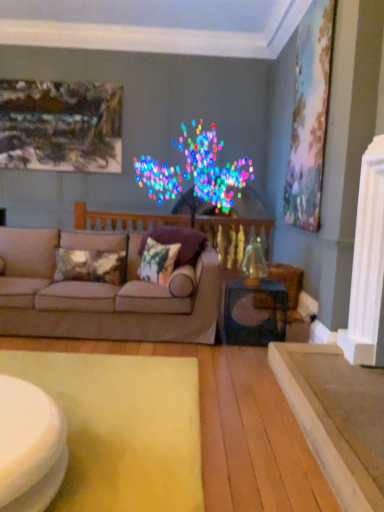
Question: Is metallic sheen pillow at center, which is the third pillow from right to left, taller than pastel canvas painting at upper right, the 2th picture frame when ordered from left to right?

Choices:
 (A) yes
 (B) no

Answer: (B)

Question: Can we say metallic sheen pillow at center, which is the third pillow from right to left, lies outside pastel canvas painting at upper right, positioned as the first picture frame in front-to-back order?

Choices:
 (A) yes
 (B) no

Answer: (A)

Question: Considering the relative sizes of metallic sheen pillow at center, marked as the first pillow in a left-to-right arrangement, and pastel canvas painting at upper right, positioned as the first picture frame in front-to-back order, in the image provided, is metallic sheen pillow at center, marked as the first pillow in a left-to-right arrangement, shorter than pastel canvas painting at upper right, positioned as the first picture frame in front-to-back order,?

Choices:
 (A) yes
 (B) no

Answer: (A)

Question: Can you confirm if metallic sheen pillow at center, which is the third pillow from right to left, is positioned to the right of pastel canvas painting at upper right, the 2th picture frame when ordered from left to right?

Choices:
 (A) yes
 (B) no

Answer: (B)

Question: From a real-world perspective, is metallic sheen pillow at center, marked as the first pillow in a left-to-right arrangement, positioned under pastel canvas painting at upper right, positioned as the first picture frame in front-to-back order, based on gravity?

Choices:
 (A) yes
 (B) no

Answer: (A)

Question: From the image's perspective, would you say metallic sheen pillow at center, which is the third pillow from right to left, is positioned over pastel canvas painting at upper right, the 1th picture frame positioned from the right?

Choices:
 (A) no
 (B) yes

Answer: (A)

Question: From the image's perspective, is beige fabric couch at center on velvet floral pillow at center, the first pillow in the right-to-left sequence?

Choices:
 (A) no
 (B) yes

Answer: (A)

Question: Can we say beige fabric couch at center lies outside velvet floral pillow at center, the 3th pillow positioned from the left?

Choices:
 (A) yes
 (B) no

Answer: (A)

Question: Is the surface of beige fabric couch at center in direct contact with velvet floral pillow at center, the first pillow in the right-to-left sequence?

Choices:
 (A) no
 (B) yes

Answer: (A)

Question: Is beige fabric couch at center further to the viewer compared to velvet floral pillow at center, the first pillow in the right-to-left sequence?

Choices:
 (A) no
 (B) yes

Answer: (A)

Question: Is beige fabric couch at center to the left of velvet floral pillow at center, the first pillow in the right-to-left sequence, from the viewer's perspective?

Choices:
 (A) no
 (B) yes

Answer: (B)

Question: Can you confirm if beige fabric couch at center is shorter than velvet floral pillow at center, the 3th pillow positioned from the left?

Choices:
 (A) yes
 (B) no

Answer: (B)

Question: From a real-world perspective, is wooden balustrade at center physically below pastel canvas painting at upper right, the 2th picture frame when ordered from left to right?

Choices:
 (A) no
 (B) yes

Answer: (B)